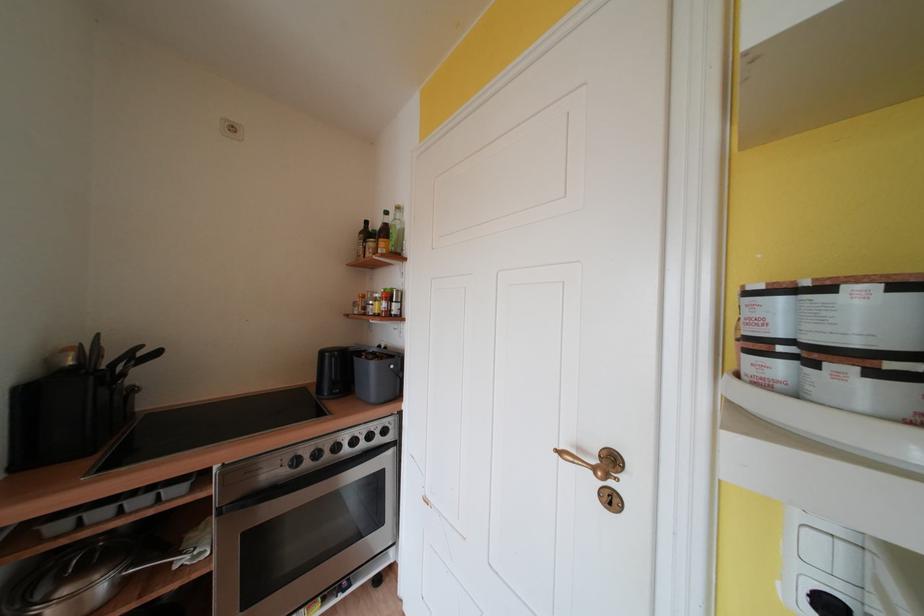
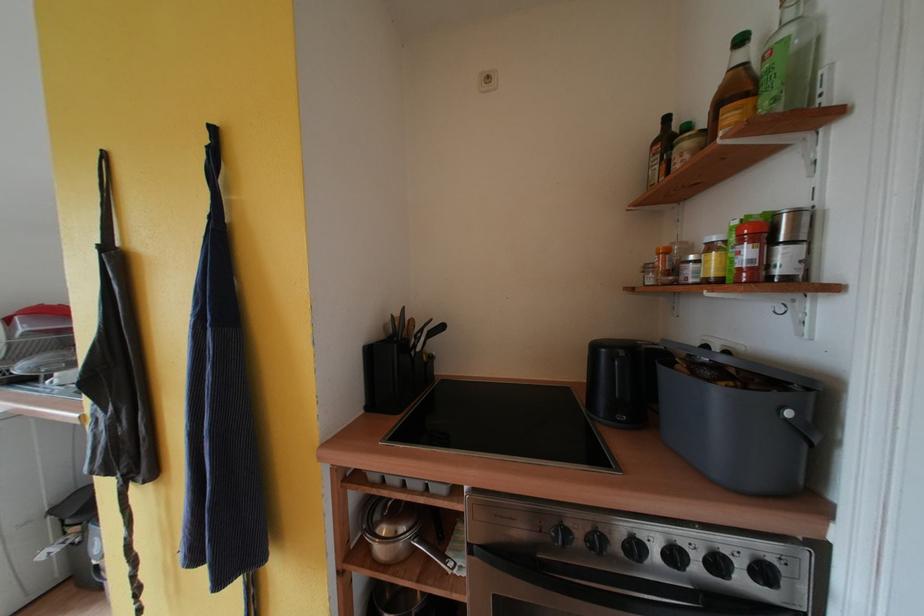
The point at (377, 440) is marked in the first image. Where is the corresponding point in the second image?

(723, 567)